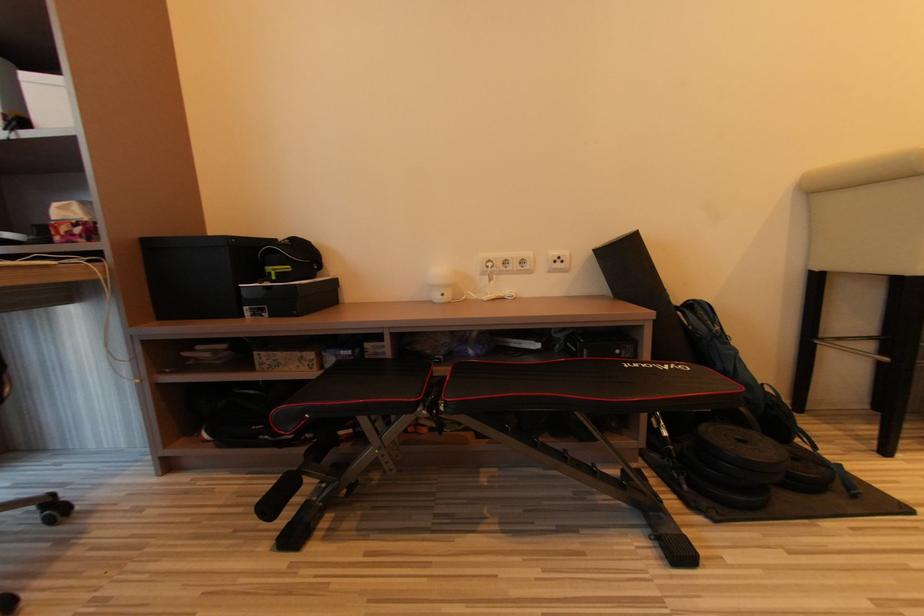
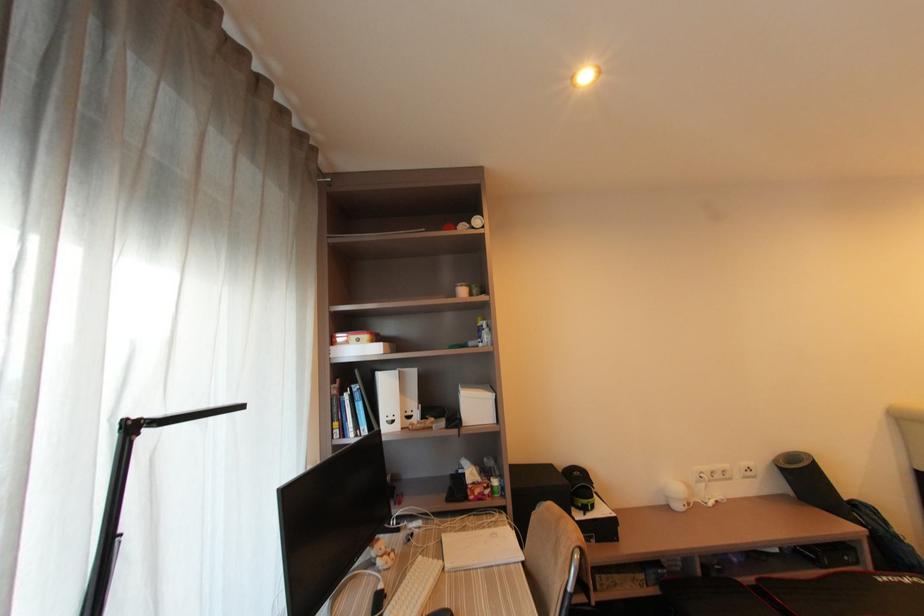
In the scene shown: What movement of the cameraman would produce the second image?

The movement direction of the cameraman is left, backward.